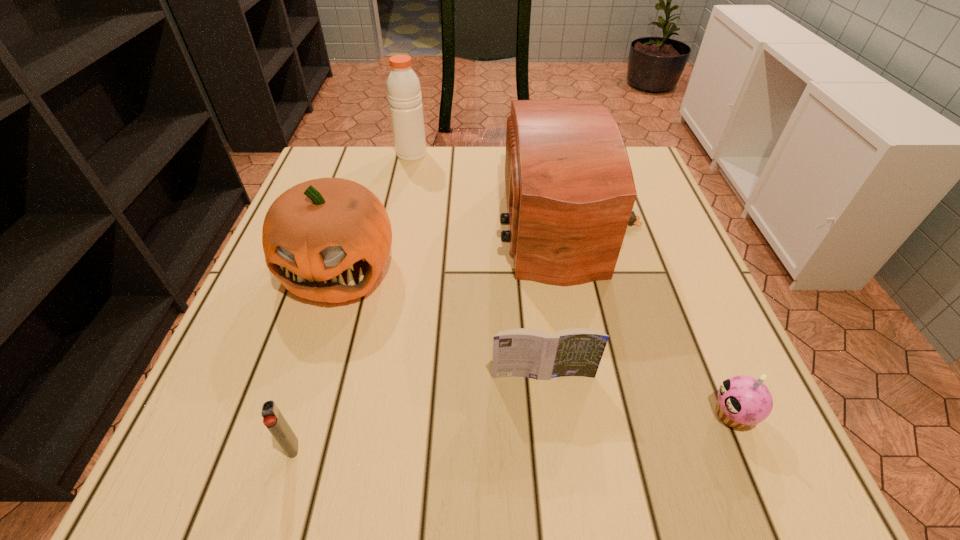
Locate an element on the screen. igniter present at the left edge is located at coordinates (273, 419).

You are a GUI agent. You are given a task and a screenshot of the screen. Output one action in this format:
    pyautogui.click(x=<x>, y=<y>)
    Task: Click on the radio receiver that is at the right edge
    The height and width of the screenshot is (540, 960).
    Given the screenshot: What is the action you would take?
    pyautogui.click(x=570, y=191)

Identify the location of cupcake that is at the right edge. (743, 401).

Identify the location of object that is at the near left corner. The image size is (960, 540). (273, 419).

Locate an element on the screen. The image size is (960, 540). object that is at the far right corner is located at coordinates (570, 191).

Where is `object that is at the near right corner`? The width and height of the screenshot is (960, 540). object that is at the near right corner is located at coordinates (743, 401).

You are a GUI agent. You are given a task and a screenshot of the screen. Output one action in this format:
    pyautogui.click(x=<x>, y=<y>)
    Task: Click on the free point at the far edge
    This screenshot has width=960, height=540.
    Given the screenshot: What is the action you would take?
    pyautogui.click(x=431, y=189)

This screenshot has height=540, width=960. I want to click on vacant region at the near edge, so click(x=500, y=458).

This screenshot has height=540, width=960. Identify the location of vacant space at the left edge. (250, 367).

The width and height of the screenshot is (960, 540). In the image, there is a desktop. In order to click on vacant space at the right edge in this screenshot , I will do `click(636, 336)`.